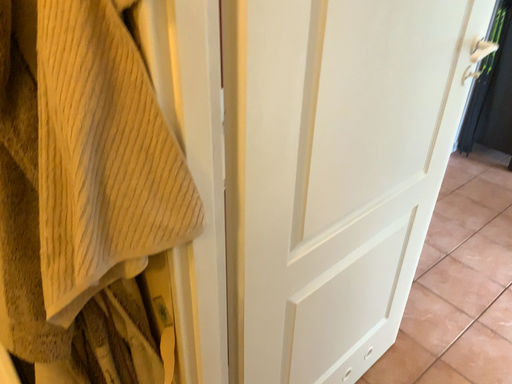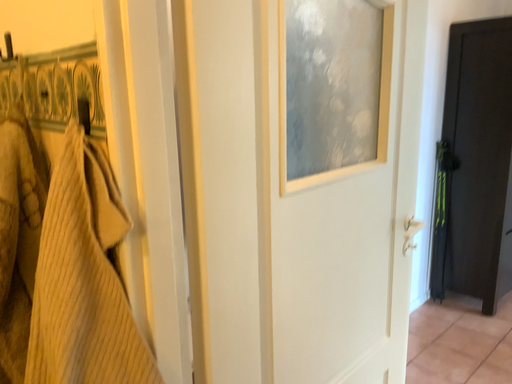
Question: How did the camera likely rotate when shooting the video?

Choices:
 (A) rotated upward
 (B) rotated downward

Answer: (A)